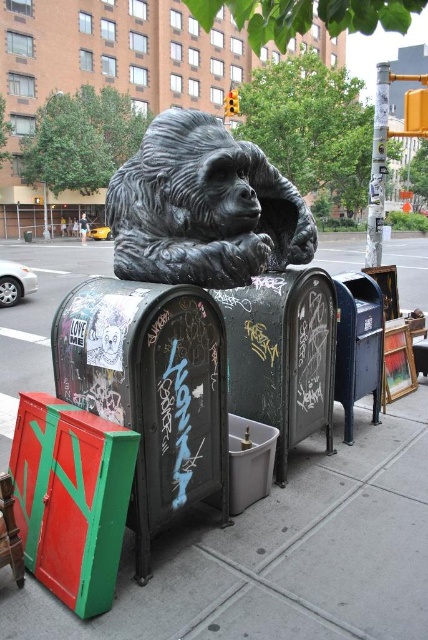
Is black textured mailbox at center bigger than metallic blue mailbox at right?

Correct, black textured mailbox at center is larger in size than metallic blue mailbox at right.

This screenshot has width=428, height=640. What are the coordinates of `black textured mailbox at center` in the screenshot? It's located at coord(151,390).

Who is higher up, black textured mailbox at center or grungy metal mailbox at center?

grungy metal mailbox at center is higher up.

Who is more distant from viewer, (77, 296) or (330, 308)?

Positioned behind is point (330, 308).

Which is in front, point (80, 317) or point (302, 333)?

Point (80, 317)

Identify the location of black textured mailbox at center. The image size is (428, 640). (151, 390).

Can you confirm if smooth concrete pavement at center is bigger than black textured mailbox at center?

Indeed, smooth concrete pavement at center has a larger size compared to black textured mailbox at center.

Consider the image. Between smooth concrete pavement at center and black textured mailbox at center, which one has less height?

Standing shorter between the two is black textured mailbox at center.

The image size is (428, 640). Find the location of `smooth concrete pavement at center`. smooth concrete pavement at center is located at coordinates (282, 554).